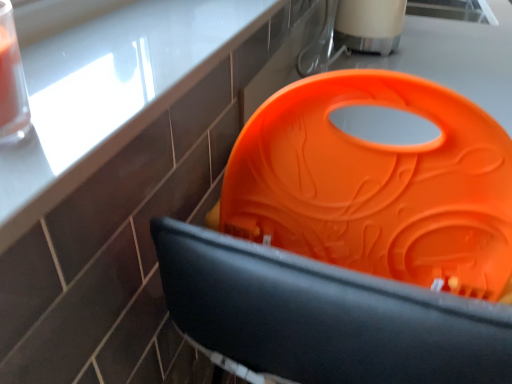
Where is `blank space above orange plastic lid at upper right (from a real-world perspective)`? blank space above orange plastic lid at upper right (from a real-world perspective) is located at coordinates (112, 45).